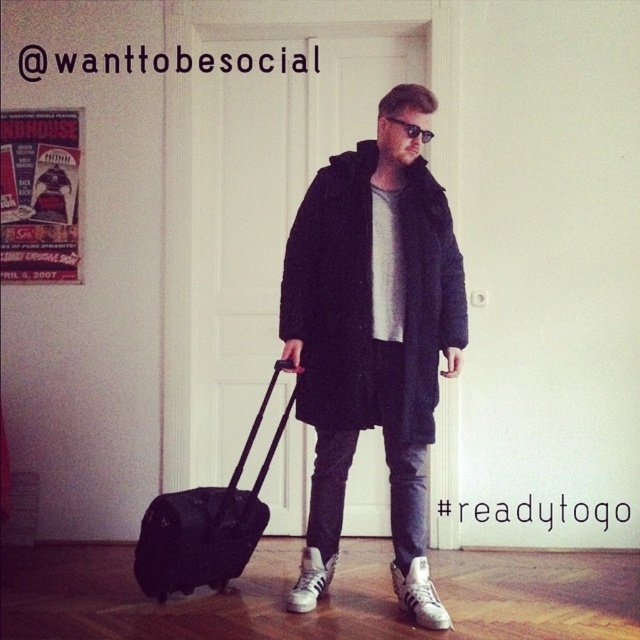
In the scene shown: You are a delivery robot that needs to deliver a package to the door in the background. The package is 10 feet long. You are currently at the position of the camera. Can you safely navigate around the black woolen coat at center without hitting it?

The black woolen coat at center is 8.03 feet away from the camera. Since the package is 10 feet long, the robot would need at least 10 feet of space to maneuver. However, the coat is only 8.03 feet away, which is shorter than the package length. Therefore, the robot cannot safely navigate around the black woolen coat at center without hitting it.

You are navigating a small robot through the room shown in the image. The robot must move from the starting point at point (404, 125) to the exit near the white door. There is an obstacle at point (161, 536) that the robot must avoid. Since the robot can only move forward and backward, can it safely navigate around the obstacle without going past the obstacle point?

Point (161, 536) is behind point (404, 125), so the obstacle is located behind the starting position. The robot can move forward towards the door without encountering the obstacle in front, making the path safe.

You are a security guard in the room. You notice the black woolen coat at center and the black plastic sunglasses at center. Which object is taller?

The black woolen coat at center is much taller than the black plastic sunglasses at center.